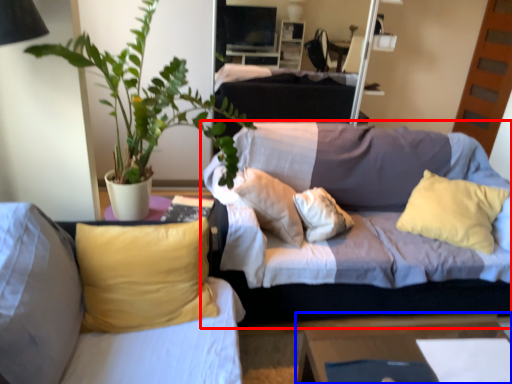
Question: Among these objects, which one is farthest to the camera, studio couch (highlighted by a red box) or table (highlighted by a blue box)?

Choices:
 (A) studio couch
 (B) table

Answer: (A)